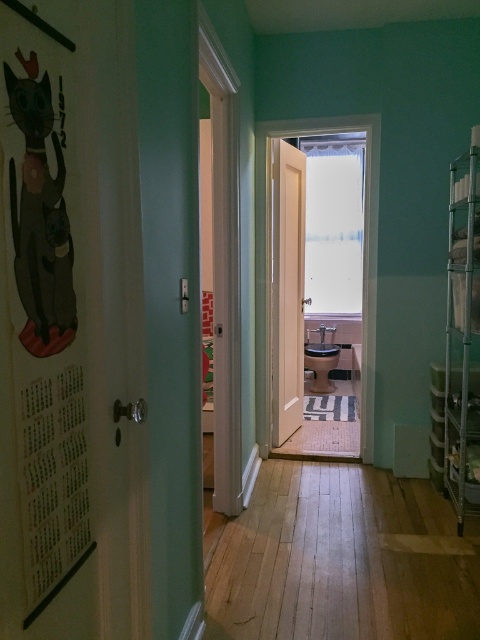
You are standing in the hallway and want to enter the bathroom. There is a matte black cat at left and light brown wood flooring at center. Which object is closer to you as you face the bathroom door?

The light brown wood flooring at center is closer to you because the matte black cat at left is behind it.

You are standing in the hallway and want to step onto the light brown wood flooring at center. Which direction should you move relative to the matte black cat at left?

You should move to the right side of the matte black cat at left to reach the light brown wood flooring at center since it is positioned on the right side of the matte black cat at left.